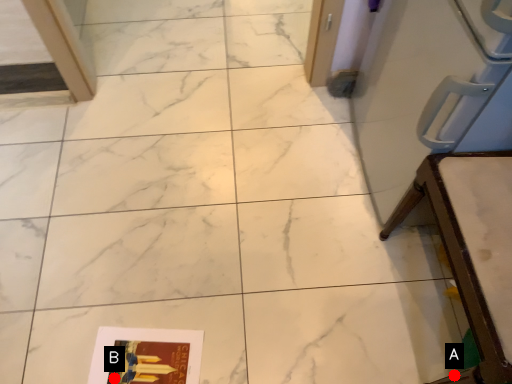
Question: Two points are circled on the image, labeled by A and B beside each circle. Among these points, which one is nearest to the camera?

Choices:
 (A) A is closer
 (B) B is closer

Answer: (A)